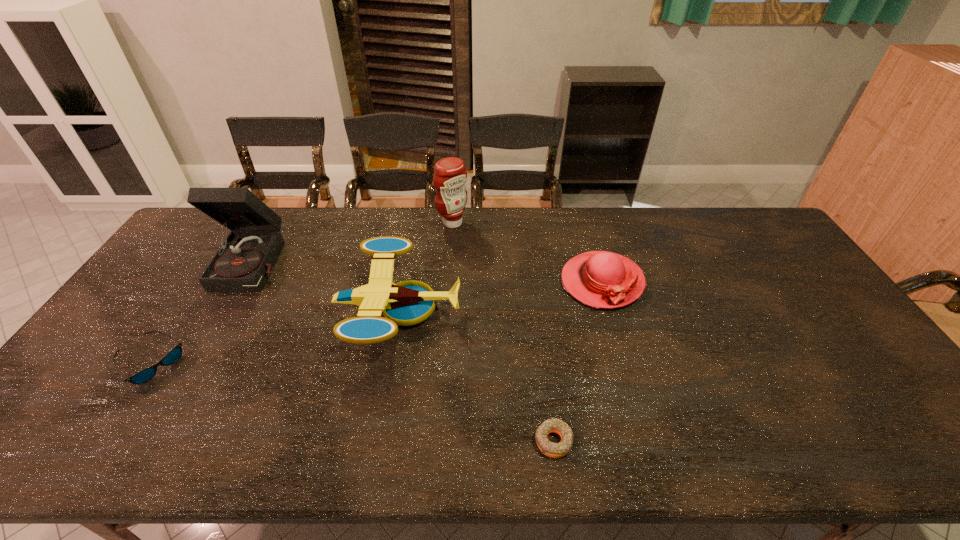
This screenshot has height=540, width=960. Find the location of `vacant area that lies between the phonograph_record and the drone`. vacant area that lies between the phonograph_record and the drone is located at coordinates (327, 286).

The width and height of the screenshot is (960, 540). Find the location of `object identified as the third closest to the drone`. object identified as the third closest to the drone is located at coordinates (555, 450).

Point out which object is positioned as the nearest to the sunglasses. Please provide its 2D coordinates. Your answer should be formatted as a tuple, i.e. [(x, y)], where the tuple contains the x and y coordinates of a point satisfying the conditions above.

[(243, 262)]

The height and width of the screenshot is (540, 960). What are the coordinates of `vacant space that satisfies the following two spatial constraints: 1. at the front of the rightmost object with a bow; 2. at the cockpit of the drone` in the screenshot? It's located at (611, 310).

At what (x,y) coordinates should I click in order to perform the action: click on free space that satisfies the following two spatial constraints: 1. on the front-facing side of the shortest object; 2. on the left side of the phonograph_record. Please return your answer as a coordinate pair (x, y). This screenshot has height=540, width=960. Looking at the image, I should click on (156, 441).

I want to click on blank space that satisfies the following two spatial constraints: 1. on the front-facing side of the phonograph_record; 2. at the front of the second shortest object showing the lenses, so click(200, 363).

Identify the location of blank area in the image that satisfies the following two spatial constraints: 1. at the front of the hat with a bow; 2. at the cockpit of the drone. (611, 310).

At what (x,y) coordinates should I click in order to perform the action: click on vacant area in the image that satisfies the following two spatial constraints: 1. on the front-facing side of the phonograph_record; 2. at the front of the sunglasses showing the lenses. Please return your answer as a coordinate pair (x, y). Looking at the image, I should click on (200, 363).

Find the location of a particular element. Image resolution: width=960 pixels, height=540 pixels. free space in the image that satisfies the following two spatial constraints: 1. at the front of the third shortest object with a bow; 2. at the front of the sunglasses showing the lenses is located at coordinates (626, 363).